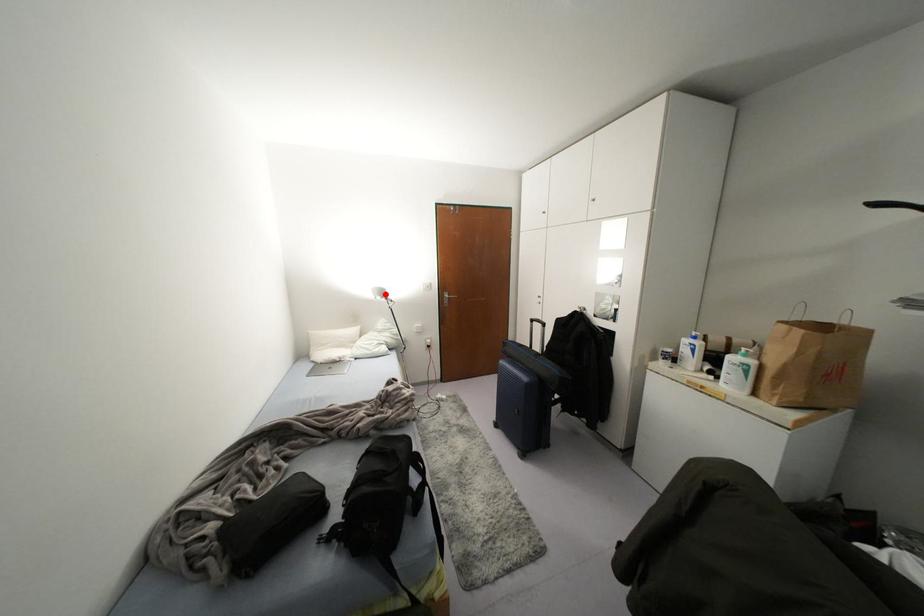
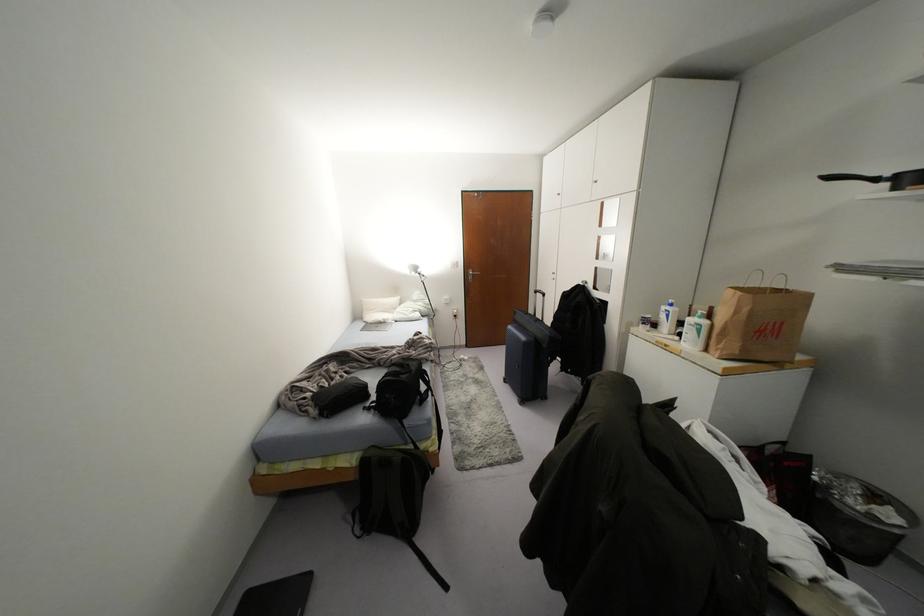
Locate, in the second image, the point that corresponds to the highlighted location in the first image.

(419, 270)